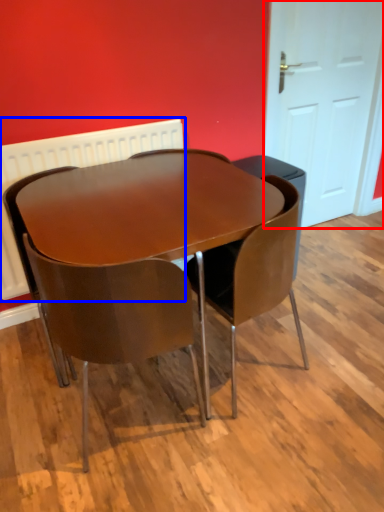
Question: Which point is closer to the camera, door (highlighted by a red box) or radiator (highlighted by a blue box)?

Choices:
 (A) door
 (B) radiator

Answer: (B)